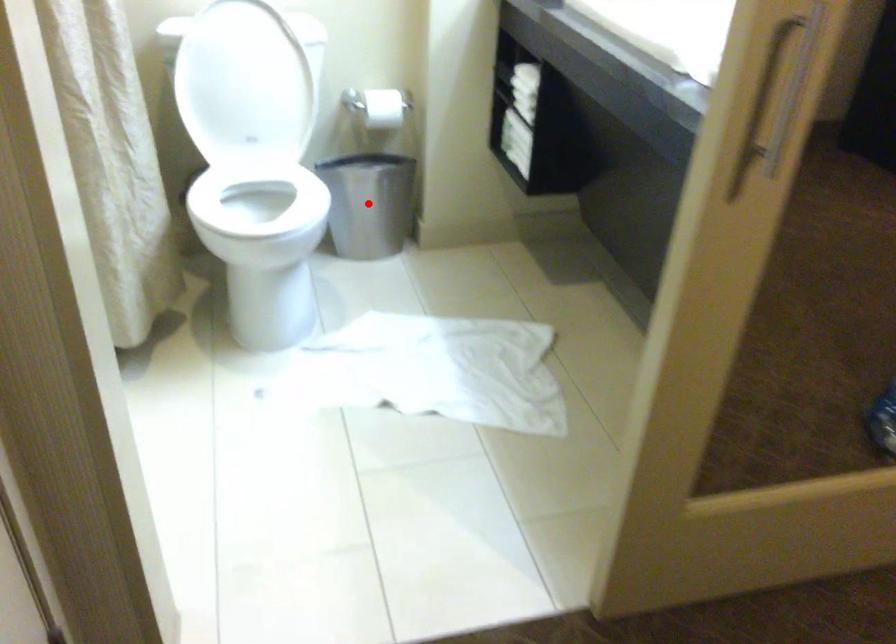
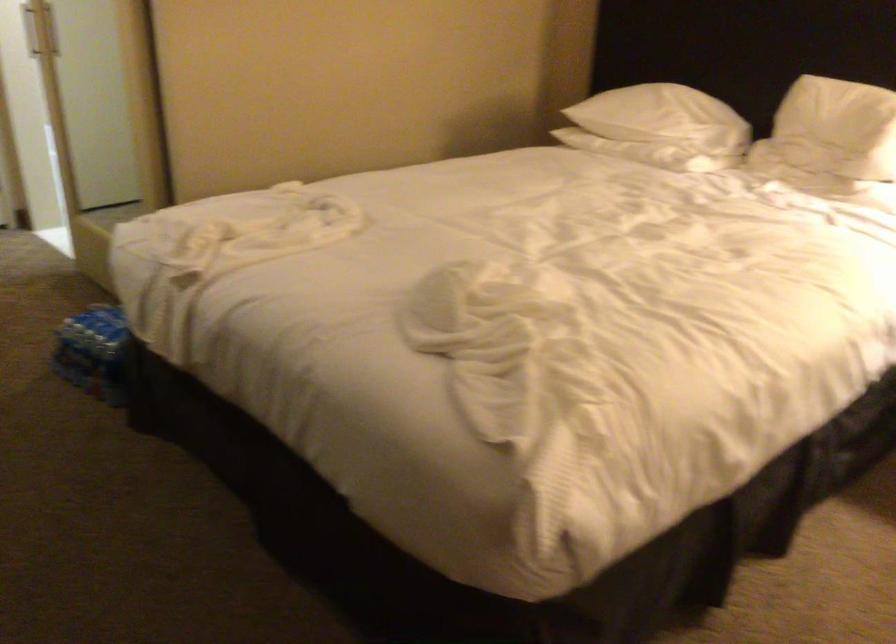
Question: I am providing you with two images of the same scene from different viewpoints. A red point is marked on the first image. Can you still see the location of the red point in image 2?

Choices:
 (A) Yes
 (B) No

Answer: (B)